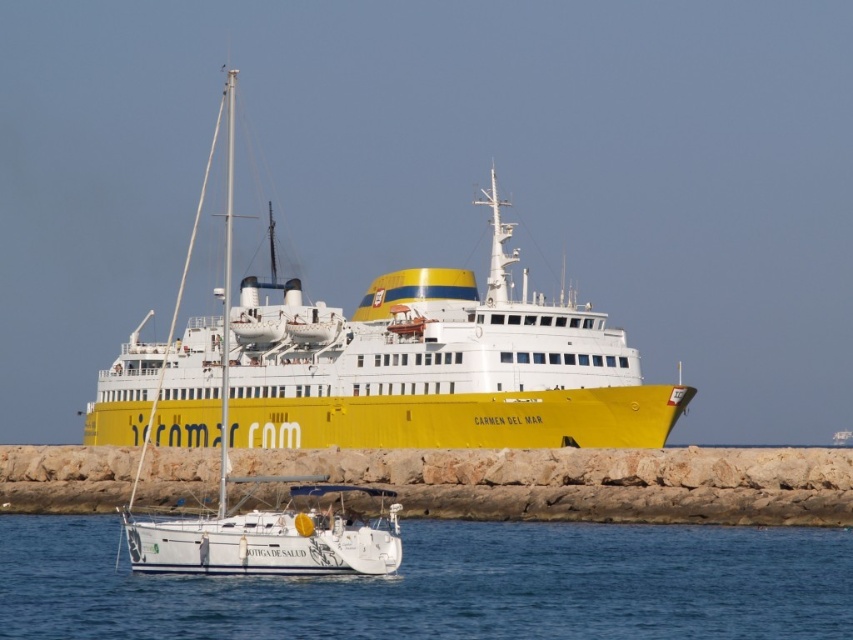
Question: Is yellow matte ship at center further to camera compared to transparent blue water at lower center?

Choices:
 (A) no
 (B) yes

Answer: (B)

Question: Which object is farther from the camera taking this photo?

Choices:
 (A) transparent blue water at lower center
 (B) yellow matte ship at center

Answer: (B)

Question: Can you confirm if yellow matte ship at center is thinner than transparent blue water at lower center?

Choices:
 (A) no
 (B) yes

Answer: (A)

Question: Which object appears closest to the camera in this image?

Choices:
 (A) yellow matte ship at center
 (B) transparent blue water at lower center

Answer: (B)

Question: Considering the relative positions of yellow matte ship at center and transparent blue water at lower center in the image provided, where is yellow matte ship at center located with respect to transparent blue water at lower center?

Choices:
 (A) below
 (B) above

Answer: (B)